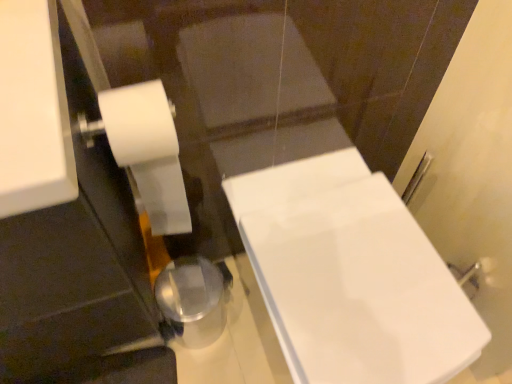
Question: Which is correct: white matte toilet paper at left is inside white glossy bathtub at center, or outside of it?

Choices:
 (A) inside
 (B) outside

Answer: (B)

Question: From a real-world perspective, is white matte toilet paper at left physically located above or below white glossy bathtub at center?

Choices:
 (A) below
 (B) above

Answer: (B)

Question: Relative to white glossy bathtub at center, is white matte toilet paper at left in front or behind?

Choices:
 (A) behind
 (B) front

Answer: (B)

Question: Is white glossy bathtub at center to the left or to the right of white matte toilet paper at left in the image?

Choices:
 (A) right
 (B) left

Answer: (A)

Question: Is point (272, 193) closer or farther from the camera than point (113, 91)?

Choices:
 (A) closer
 (B) farther

Answer: (B)

Question: In terms of height, does white glossy bathtub at center look taller or shorter compared to white matte toilet paper at left?

Choices:
 (A) tall
 (B) short

Answer: (A)

Question: Is white glossy bathtub at center wider or thinner than white matte toilet paper at left?

Choices:
 (A) thin
 (B) wide

Answer: (B)